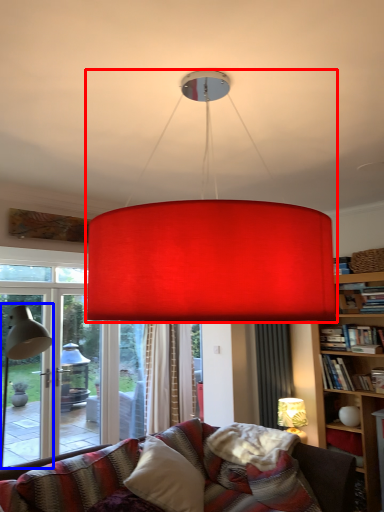
Question: Among these objects, which one is nearest to the camera, lamp (highlighted by a red box) or table lamp (highlighted by a blue box)?

Choices:
 (A) lamp
 (B) table lamp

Answer: (A)